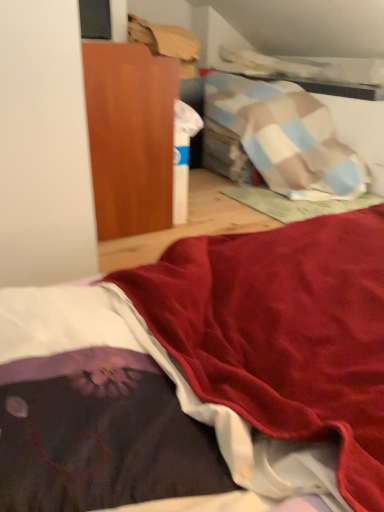
Question: Should I look upward or downward to see velvet dark purple blanket at lower left?

Choices:
 (A) up
 (B) down

Answer: (B)

Question: Does velvet dark purple blanket at lower left appear on the left side of wooden cabinet at upper left?

Choices:
 (A) no
 (B) yes

Answer: (A)

Question: Does velvet dark purple blanket at lower left have a greater height compared to wooden cabinet at upper left?

Choices:
 (A) yes
 (B) no

Answer: (B)

Question: Does velvet dark purple blanket at lower left have a larger size compared to wooden cabinet at upper left?

Choices:
 (A) no
 (B) yes

Answer: (A)

Question: Can you confirm if velvet dark purple blanket at lower left is positioned to the right of wooden cabinet at upper left?

Choices:
 (A) yes
 (B) no

Answer: (A)

Question: Does velvet dark purple blanket at lower left have a lesser height compared to wooden cabinet at upper left?

Choices:
 (A) yes
 (B) no

Answer: (A)

Question: Can you confirm if velvet dark purple blanket at lower left is thinner than wooden cabinet at upper left?

Choices:
 (A) no
 (B) yes

Answer: (B)

Question: Is wooden cabinet at upper left facing towards velvet dark purple blanket at lower left?

Choices:
 (A) no
 (B) yes

Answer: (A)

Question: Is wooden cabinet at upper left taller than velvet dark purple blanket at lower left?

Choices:
 (A) no
 (B) yes

Answer: (B)

Question: Is the surface of wooden cabinet at upper left in direct contact with velvet dark purple blanket at lower left?

Choices:
 (A) no
 (B) yes

Answer: (A)

Question: Is wooden cabinet at upper left located outside velvet dark purple blanket at lower left?

Choices:
 (A) yes
 (B) no

Answer: (A)

Question: Does wooden cabinet at upper left appear on the left side of velvet dark purple blanket at lower left?

Choices:
 (A) no
 (B) yes

Answer: (B)

Question: From a real-world perspective, is wooden cabinet at upper left located higher than velvet dark purple blanket at lower left?

Choices:
 (A) yes
 (B) no

Answer: (A)

Question: From a real-world perspective, is velvet dark purple blanket at lower left positioned above or below wooden cabinet at upper left?

Choices:
 (A) below
 (B) above

Answer: (A)